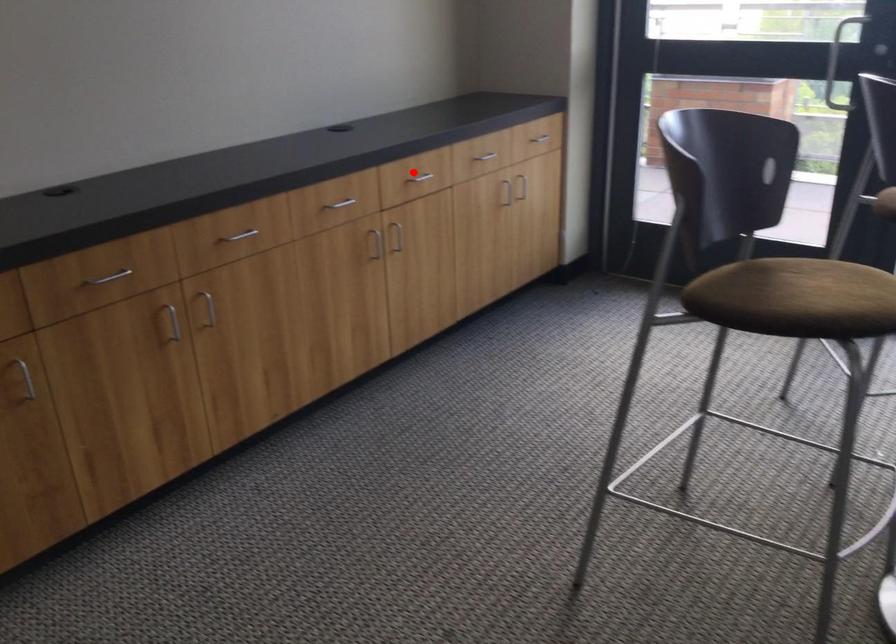
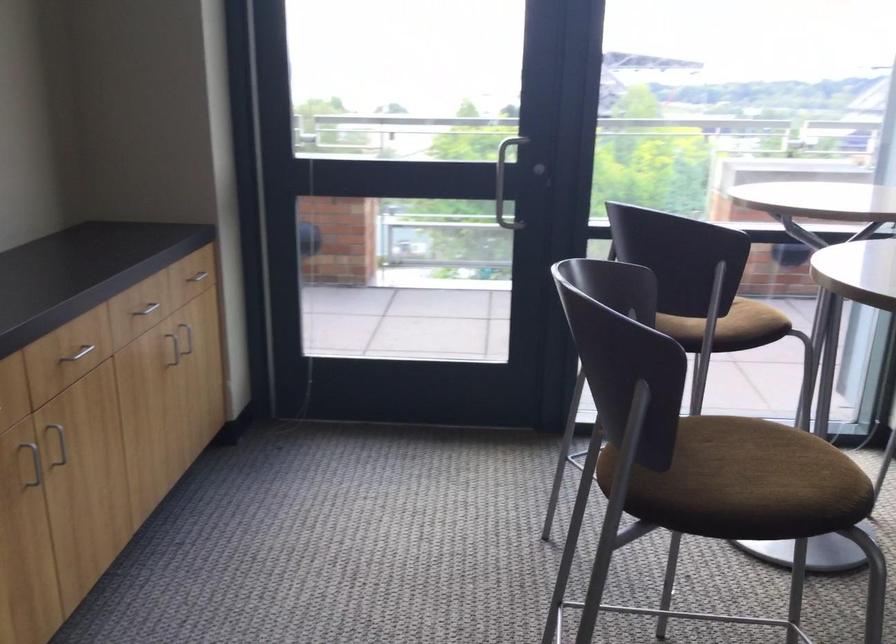
Question: I am providing you with two images of the same scene from different viewpoints. In image1, a red point is highlighted. Considering the same 3D point in image2, which of the following is correct?

Choices:
 (A) It is closer
 (B) It is farther

Answer: (A)